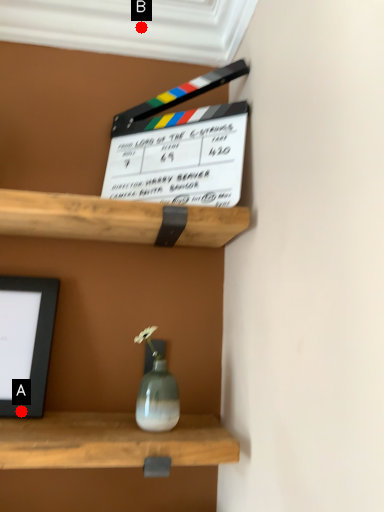
Question: Two points are circled on the image, labeled by A and B beside each circle. Which point is farther to the camera?

Choices:
 (A) A is further
 (B) B is further

Answer: (B)